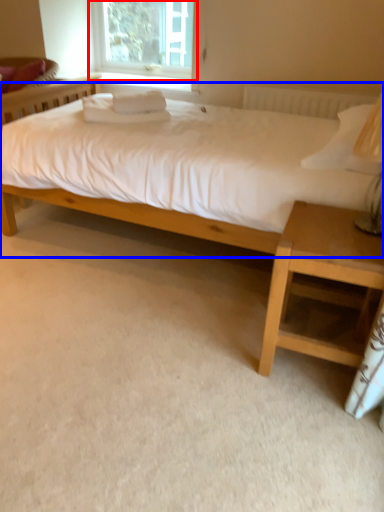
Question: Which object is closer to the camera taking this photo, window (highlighted by a red box) or bed (highlighted by a blue box)?

Choices:
 (A) window
 (B) bed

Answer: (B)